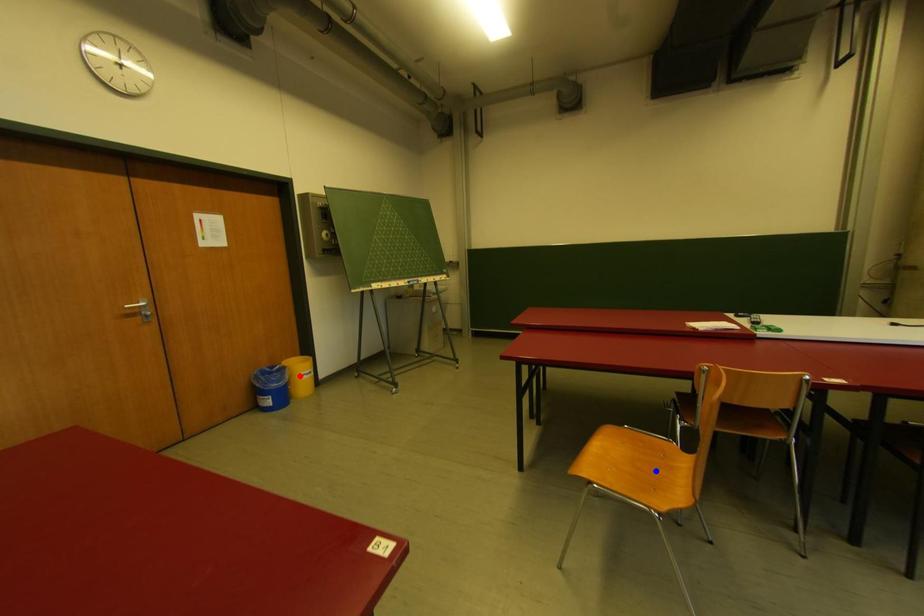
Question: In the image, two points are highlighted. Which point is nearer to the camera? Reply with the corresponding letter.

Choices:
 (A) blue point
 (B) red point

Answer: (A)